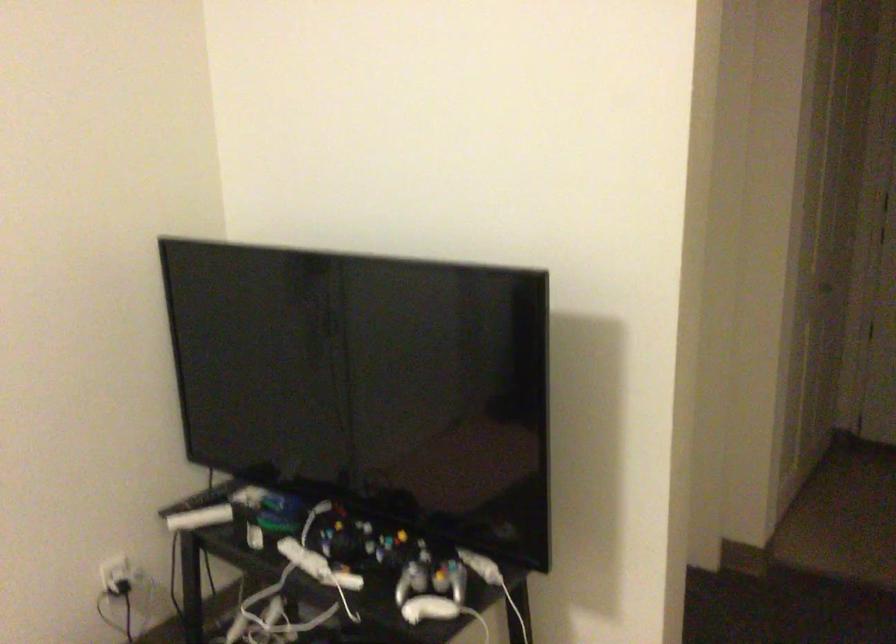
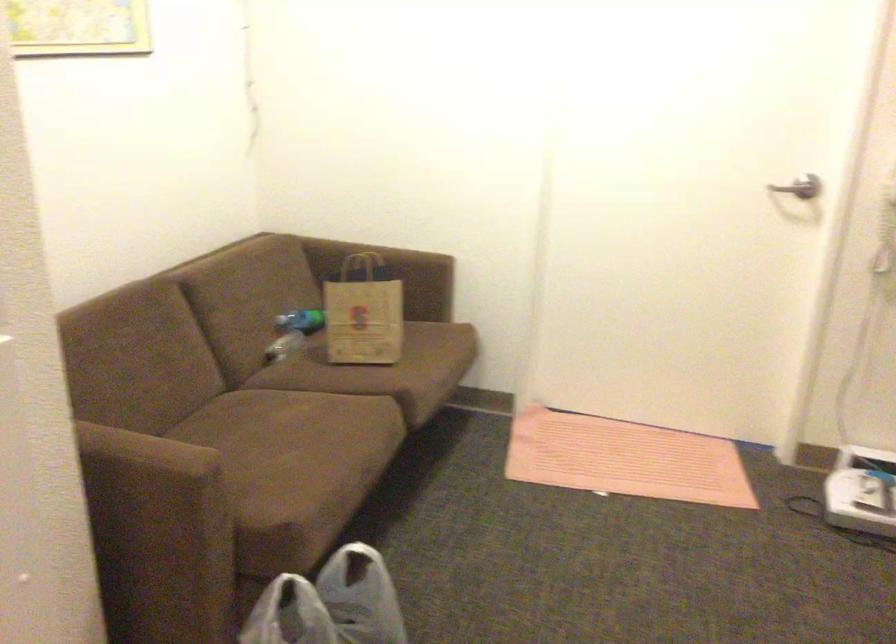
The first image is from the beginning of the video and the second image is from the end. How did the camera likely rotate when shooting the video?

The rotation direction of the camera is left-down.